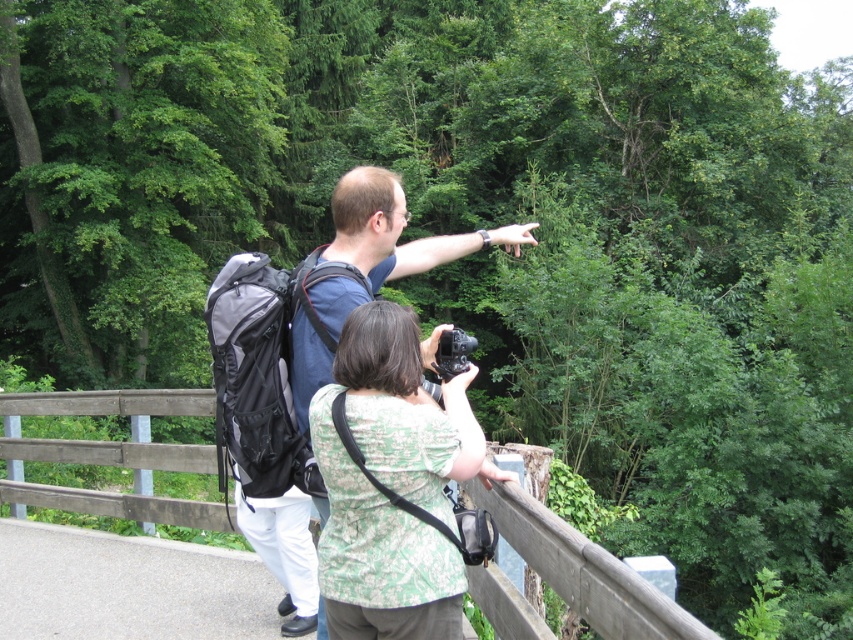
Can you confirm if green textured shirt at center is positioned to the right of matte blue shirt at center?

Incorrect, green textured shirt at center is not on the right side of matte blue shirt at center.

Is green textured shirt at center in front of matte blue shirt at center?

Yes, green textured shirt at center is closer to the viewer.

Measure the distance between green textured shirt at center and camera.

green textured shirt at center and camera are 2.15 meters apart.

The image size is (853, 640). Identify the location of green textured shirt at center. (392, 483).

Does wooden at upper center have a greater height compared to black plastic camera at center?

Indeed, wooden at upper center has a greater height compared to black plastic camera at center.

Is wooden at upper center bigger than black plastic camera at center?

Indeed, wooden at upper center has a larger size compared to black plastic camera at center.

Does point (12, 404) come behind point (462, 356)?

Yes, it is behind point (462, 356).

Where is `wooden at upper center`? The image size is (853, 640). wooden at upper center is located at coordinates (585, 570).

Does matte blue shirt at center have a lesser height compared to black plastic camera at center?

Incorrect, matte blue shirt at center's height does not fall short of black plastic camera at center's.

I want to click on matte blue shirt at center, so click(x=398, y=230).

Between point (338, 196) and point (440, 356), which one is positioned behind?

Point (338, 196)

Identify the location of matte blue shirt at center. (398, 230).